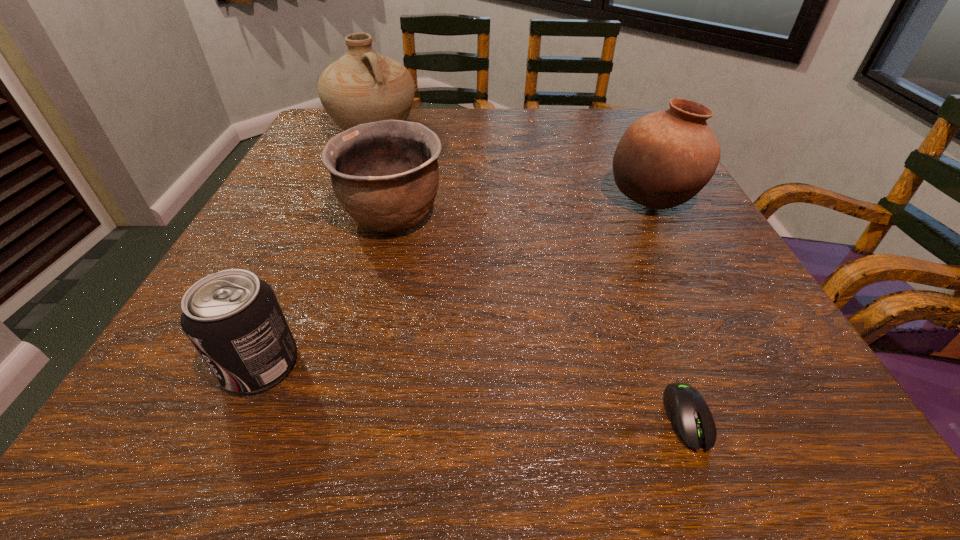
The height and width of the screenshot is (540, 960). I want to click on the farthest pottery, so click(363, 86).

Locate an element on the screen. the rightmost pottery is located at coordinates (665, 158).

You are a GUI agent. You are given a task and a screenshot of the screen. Output one action in this format:
    pyautogui.click(x=<x>, y=<y>)
    Task: Click on the shortest pottery
    The height and width of the screenshot is (540, 960).
    Given the screenshot: What is the action you would take?
    pyautogui.click(x=385, y=174)

Where is `soda can`? The height and width of the screenshot is (540, 960). soda can is located at coordinates (233, 319).

You are a GUI agent. You are given a task and a screenshot of the screen. Output one action in this format:
    pyautogui.click(x=<x>, y=<y>)
    Task: Click on the shortest object
    This screenshot has height=540, width=960.
    Given the screenshot: What is the action you would take?
    pyautogui.click(x=688, y=412)

Identify the location of free space located 0.140m on the right of the farthest object. The image size is (960, 540). (473, 130).

The height and width of the screenshot is (540, 960). I want to click on vacant region located on the front of the rightmost pottery, so click(691, 278).

The width and height of the screenshot is (960, 540). What are the coordinates of `vacant region located on the front of the shortest pottery` in the screenshot? It's located at click(356, 370).

Locate an element on the screen. The width and height of the screenshot is (960, 540). vacant space located 0.050m on the right of the soda can is located at coordinates (335, 364).

Where is `object located at the far edge`? object located at the far edge is located at coordinates click(x=363, y=86).